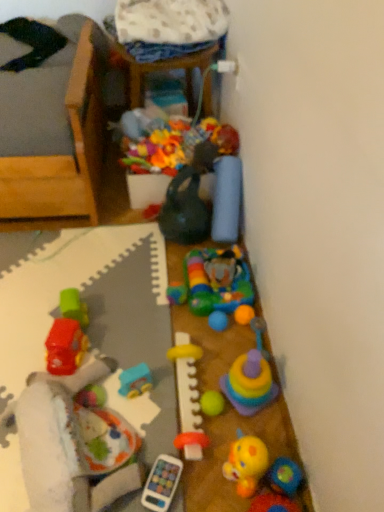
The image size is (384, 512). Identify the location of free location in front of yellow rubber teething ring at center, positioned as the eighth toy in right-to-left order. (181, 456).